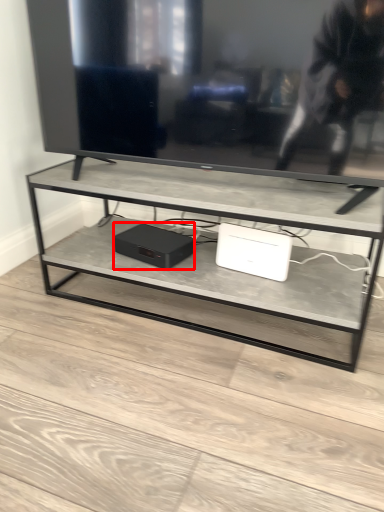
Question: From the image's perspective, what is the correct spatial positioning of computer (annotated by the red box) in reference to computer?

Choices:
 (A) above
 (B) below

Answer: (A)